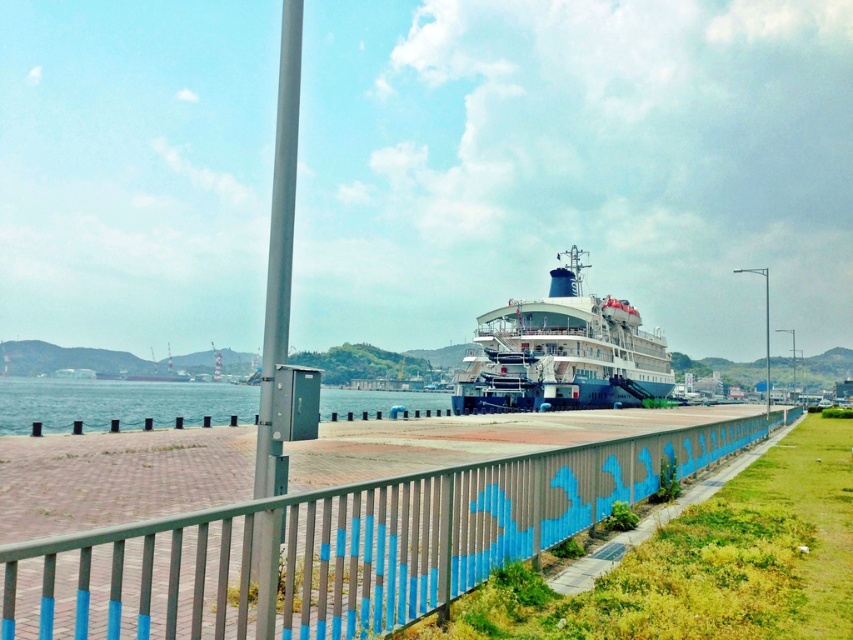
Question: Based on their relative distances, which object is farther from the clear water at lower left?

Choices:
 (A) metallic blue fence at center
 (B) white glossy cruise ship at center

Answer: (A)

Question: Where is metallic blue fence at center located in relation to clear water at lower left in the image?

Choices:
 (A) below
 (B) above

Answer: (B)

Question: Which object appears farthest from the camera in this image?

Choices:
 (A) white glossy cruise ship at center
 (B) clear water at lower left
 (C) metallic blue fence at center

Answer: (A)

Question: Does metallic blue fence at center have a greater width compared to white glossy cruise ship at center?

Choices:
 (A) no
 (B) yes

Answer: (A)

Question: Which object is the closest to the white glossy cruise ship at center?

Choices:
 (A) clear water at lower left
 (B) metallic blue fence at center

Answer: (A)

Question: Is metallic blue fence at center below white glossy cruise ship at center?

Choices:
 (A) no
 (B) yes

Answer: (B)